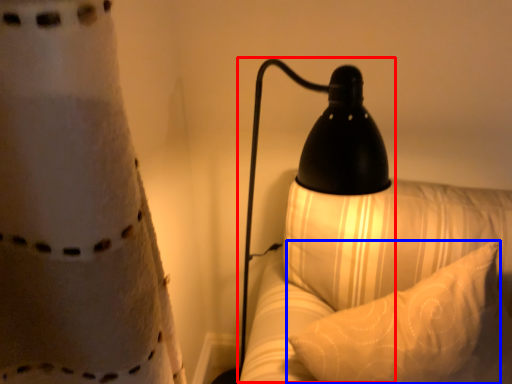
Question: Which of the following is the closest to the observer, lamp (highlighted by a red box) or pillow (highlighted by a blue box)?

Choices:
 (A) lamp
 (B) pillow

Answer: (A)